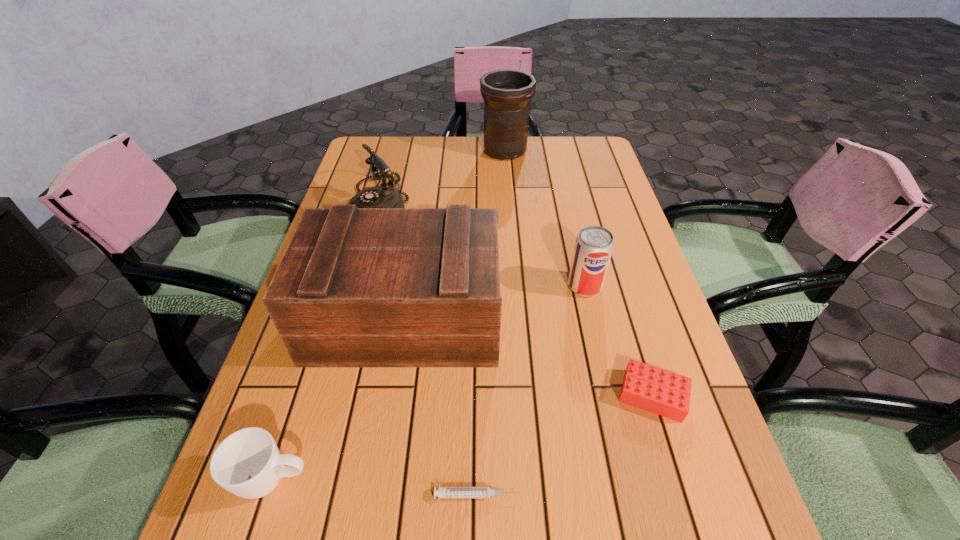
What are the coordinates of `telephoto lens` in the screenshot? It's located at pos(507,94).

The height and width of the screenshot is (540, 960). I want to click on box, so click(356, 287).

Where is `telephone`? The image size is (960, 540). telephone is located at coordinates (384, 196).

In order to click on soda in this screenshot , I will do `click(594, 245)`.

The image size is (960, 540). I want to click on the fifth tallest object, so click(x=247, y=463).

The height and width of the screenshot is (540, 960). In order to click on the second shortest object in this screenshot , I will do `click(653, 389)`.

Image resolution: width=960 pixels, height=540 pixels. What are the coordinates of `Lego` in the screenshot? It's located at (653, 389).

You are a GUI agent. You are given a task and a screenshot of the screen. Output one action in this format:
    pyautogui.click(x=<x>, y=<y>)
    Task: Click on the shortest object
    This screenshot has width=960, height=540.
    Given the screenshot: What is the action you would take?
    [x=443, y=492]

Locate an element on the screen. The height and width of the screenshot is (540, 960). vacant space located on the left of the telephoto lens is located at coordinates (405, 151).

Where is `free space located on the front of the box`? free space located on the front of the box is located at coordinates (372, 531).